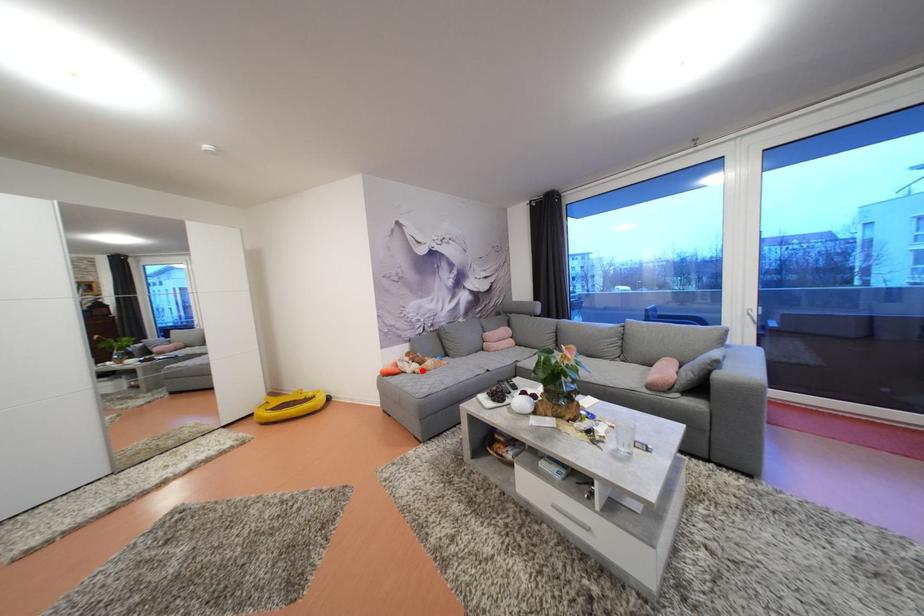
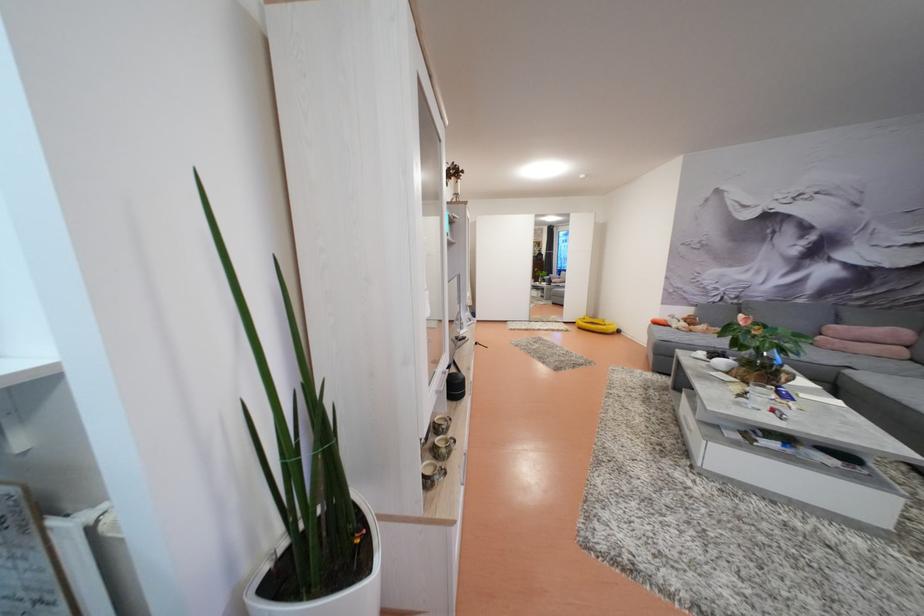
Question: I am providing you with two images of the same scene from different viewpoints. A red point is marked on the first image. At the location where the point appears in image 1, is it still visible in image 2?

Choices:
 (A) Yes
 (B) No

Answer: (A)